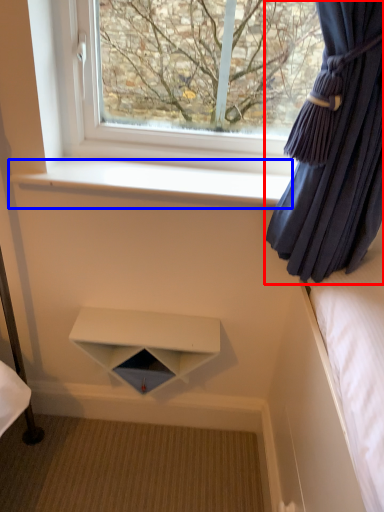
Question: Which object appears farthest to the camera in this image, curtain (highlighted by a red box) or window sill (highlighted by a blue box)?

Choices:
 (A) curtain
 (B) window sill

Answer: (B)